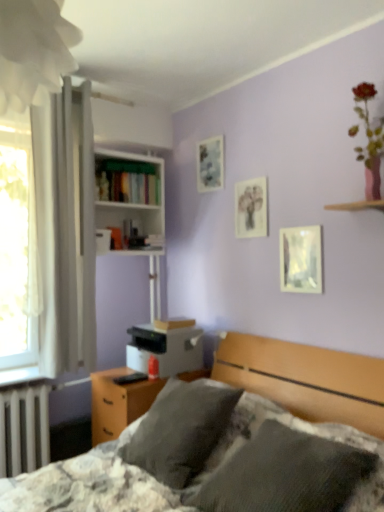
Question: Which direction should I rotate to face fluffy gray pillow at center, which is counted as the first pillow, starting from the front, — up or down?

Choices:
 (A) up
 (B) down

Answer: (B)

Question: Is the depth of gray soft pillow at center, which is the first pillow in back-to-front order, greater than that of white metallic radiator at lower left?

Choices:
 (A) yes
 (B) no

Answer: (B)

Question: Does gray soft pillow at center, positioned as the second pillow in front-to-back order, appear on the left side of white metallic radiator at lower left?

Choices:
 (A) no
 (B) yes

Answer: (A)

Question: Is gray soft pillow at center, which is the first pillow in back-to-front order, positioned with its back to white metallic radiator at lower left?

Choices:
 (A) yes
 (B) no

Answer: (B)

Question: Is gray soft pillow at center, positioned as the second pillow in front-to-back order, positioned far away from white metallic radiator at lower left?

Choices:
 (A) no
 (B) yes

Answer: (A)

Question: From a real-world perspective, is gray soft pillow at center, positioned as the second pillow in front-to-back order, beneath white metallic radiator at lower left?

Choices:
 (A) yes
 (B) no

Answer: (B)

Question: From the image's perspective, is gray soft pillow at center, which is the first pillow in back-to-front order, beneath white metallic radiator at lower left?

Choices:
 (A) yes
 (B) no

Answer: (B)

Question: Can you confirm if metallic reflective picture frame at upper right, which ranks as the 1th picture frame in right-to-left order, is taller than white metallic radiator at lower left?

Choices:
 (A) no
 (B) yes

Answer: (A)

Question: Is white metallic radiator at lower left a part of metallic reflective picture frame at upper right, the first picture frame positioned from the bottom?

Choices:
 (A) no
 (B) yes

Answer: (A)

Question: Can you confirm if metallic reflective picture frame at upper right, the third picture frame when ordered from back to front, is positioned to the right of white metallic radiator at lower left?

Choices:
 (A) no
 (B) yes

Answer: (B)

Question: Could you tell me if metallic reflective picture frame at upper right, which ranks as the 1th picture frame in right-to-left order, is facing white metallic radiator at lower left?

Choices:
 (A) no
 (B) yes

Answer: (A)

Question: Can you confirm if metallic reflective picture frame at upper right, positioned as the third picture frame in top-to-bottom order, is wider than white metallic radiator at lower left?

Choices:
 (A) no
 (B) yes

Answer: (A)

Question: Is metallic reflective picture frame at upper right, the 1th picture frame in the front-to-back sequence, positioned in front of white metallic radiator at lower left?

Choices:
 (A) no
 (B) yes

Answer: (B)

Question: Are matte paper picture frame at center, which is counted as the second picture frame, starting from the right, and white glossy bookcase at upper center far apart?

Choices:
 (A) yes
 (B) no

Answer: (B)